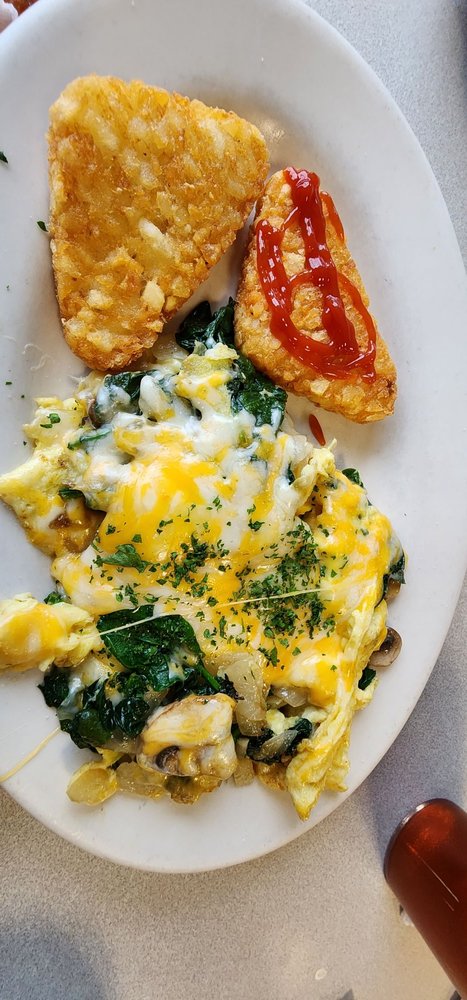
The height and width of the screenshot is (1000, 467). I want to click on plate, so click(x=233, y=833), click(x=363, y=110).